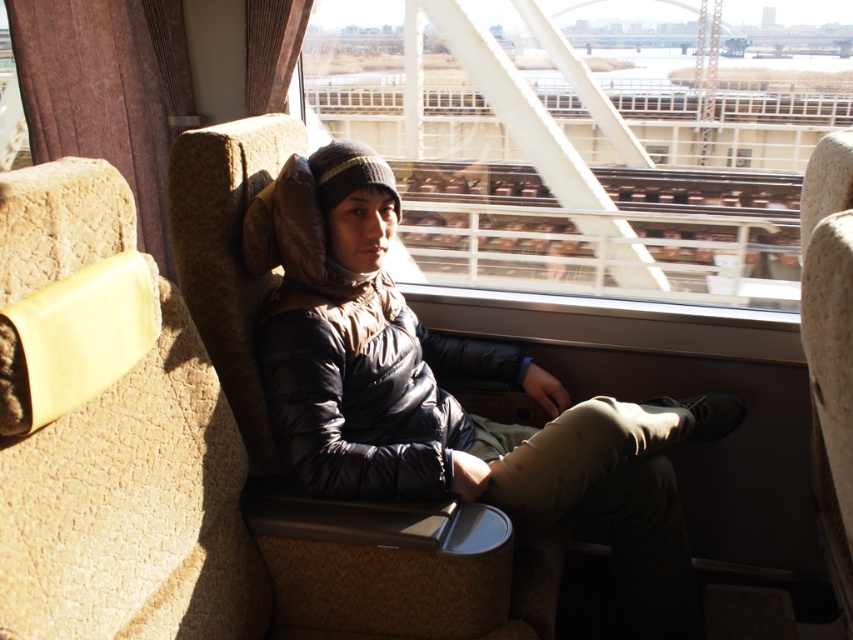
You are a passenger in the train carriage and looking through the window. There are two points marked on the window at coordinates point [761,115] and point [453,369]. Which point is closer to you?

Point [453,369] is closer to you because it is nearer to the camera compared to point [761,115], which is further away.

You are sitting in the train seat and want to look at the view outside the transparent glass train window at center. Is the matte black jacket at center blocking your view of the window?

The transparent glass train window at center is further to the viewer than the matte black jacket at center, so the jacket is closer to you and would block your view of the window.